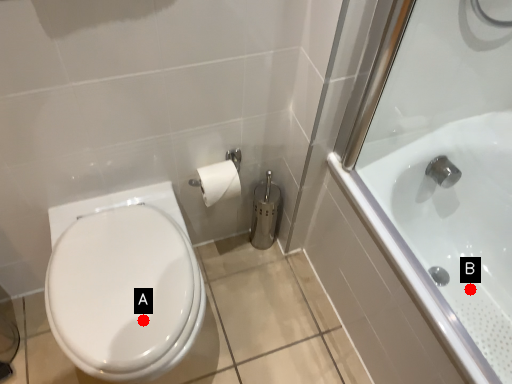
Question: Two points are circled on the image, labeled by A and B beside each circle. Which point is closer to the camera taking this photo?

Choices:
 (A) A is closer
 (B) B is closer

Answer: (A)